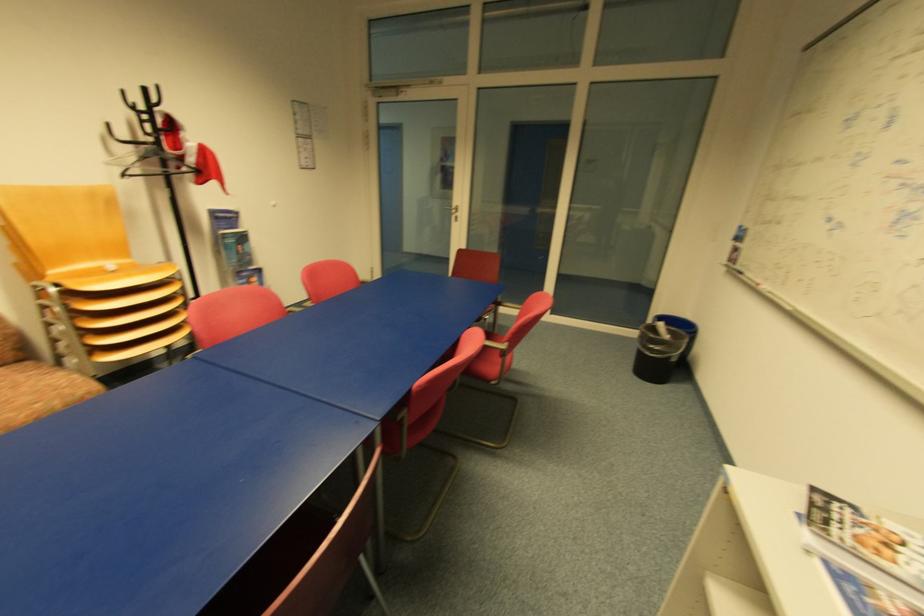
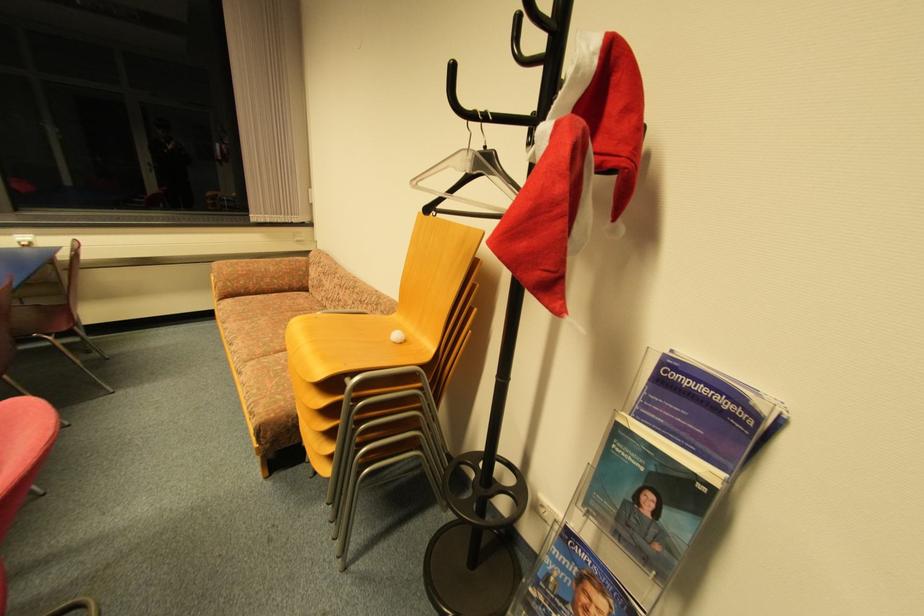
The point at (248, 275) is marked in the first image. Where is the corresponding point in the second image?

(588, 557)